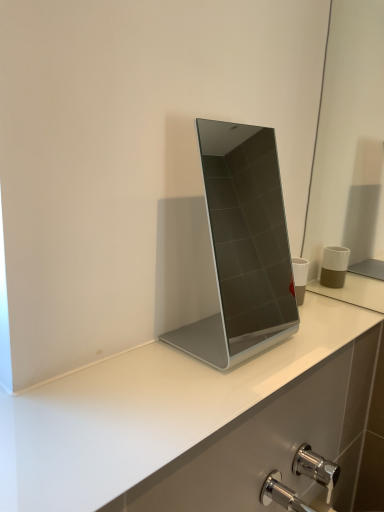
Question: From the image's perspective, is sleek silver laptop at center on top of chrome metallic tap at lower right?

Choices:
 (A) yes
 (B) no

Answer: (A)

Question: From a real-world perspective, is sleek silver laptop at center located higher than chrome metallic tap at lower right?

Choices:
 (A) yes
 (B) no

Answer: (A)

Question: Is sleek silver laptop at center to the right of chrome metallic tap at lower right from the viewer's perspective?

Choices:
 (A) no
 (B) yes

Answer: (A)

Question: From the image's perspective, would you say sleek silver laptop at center is shown under chrome metallic tap at lower right?

Choices:
 (A) no
 (B) yes

Answer: (A)

Question: Can you confirm if sleek silver laptop at center is smaller than chrome metallic tap at lower right?

Choices:
 (A) no
 (B) yes

Answer: (A)

Question: Is sleek silver laptop at center at the left side of chrome metallic tap at lower right?

Choices:
 (A) yes
 (B) no

Answer: (A)

Question: Considering the relative sizes of chrome metallic tap at lower right and sleek silver laptop at center in the image provided, is chrome metallic tap at lower right taller than sleek silver laptop at center?

Choices:
 (A) no
 (B) yes

Answer: (A)

Question: Is chrome metallic tap at lower right positioned behind sleek silver laptop at center?

Choices:
 (A) no
 (B) yes

Answer: (B)

Question: Does chrome metallic tap at lower right have a greater width compared to sleek silver laptop at center?

Choices:
 (A) yes
 (B) no

Answer: (B)

Question: From the image's perspective, would you say chrome metallic tap at lower right is positioned over sleek silver laptop at center?

Choices:
 (A) no
 (B) yes

Answer: (A)

Question: Is chrome metallic tap at lower right bigger than sleek silver laptop at center?

Choices:
 (A) yes
 (B) no

Answer: (B)

Question: Is chrome metallic tap at lower right oriented away from sleek silver laptop at center?

Choices:
 (A) no
 (B) yes

Answer: (A)

Question: From the image's perspective, is chrome metallic tap at lower right located above or below sleek silver laptop at center?

Choices:
 (A) below
 (B) above

Answer: (A)